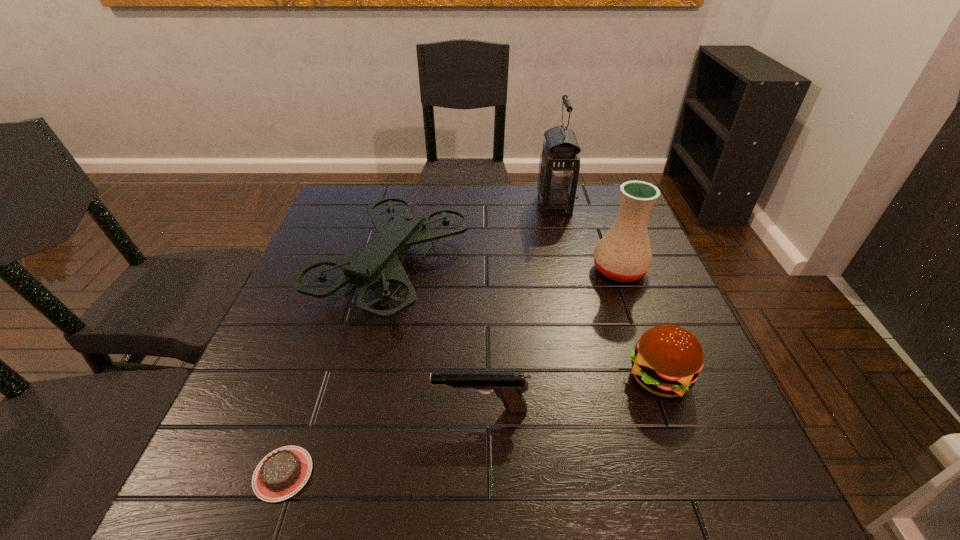
Locate an element on the screen. vacant space in between the farthest object and the hamburger is located at coordinates (607, 291).

In order to click on vacant region between the chocolate cake and the drone in this screenshot , I will do `click(338, 371)`.

Locate an element on the screen. The width and height of the screenshot is (960, 540). object identified as the fifth closest to the hamburger is located at coordinates (282, 473).

The height and width of the screenshot is (540, 960). In order to click on object identified as the closest to the pottery in this screenshot , I will do (559, 165).

The width and height of the screenshot is (960, 540). Find the location of `vacant space that satisfies the following two spatial constraints: 1. on the front side of the drone; 2. on the left side of the hamburger`. vacant space that satisfies the following two spatial constraints: 1. on the front side of the drone; 2. on the left side of the hamburger is located at coordinates (367, 377).

Where is `free spot that satisfies the following two spatial constraints: 1. on the front-facing side of the tallest object; 2. on the back side of the pottery`? free spot that satisfies the following two spatial constraints: 1. on the front-facing side of the tallest object; 2. on the back side of the pottery is located at coordinates (570, 270).

The width and height of the screenshot is (960, 540). Find the location of `free space that satisfies the following two spatial constraints: 1. on the front side of the hamburger; 2. on the right side of the drone`. free space that satisfies the following two spatial constraints: 1. on the front side of the hamburger; 2. on the right side of the drone is located at coordinates (367, 377).

Locate an element on the screen. free space that satisfies the following two spatial constraints: 1. on the front-facing side of the hamburger; 2. on the left side of the lantern is located at coordinates (595, 377).